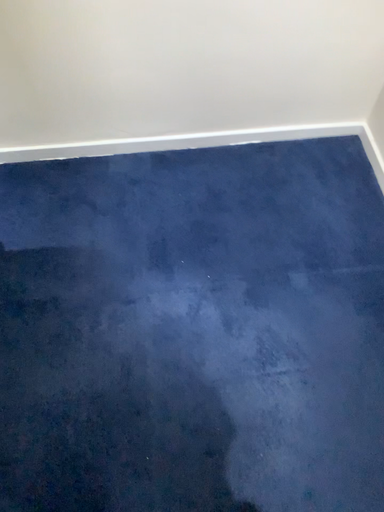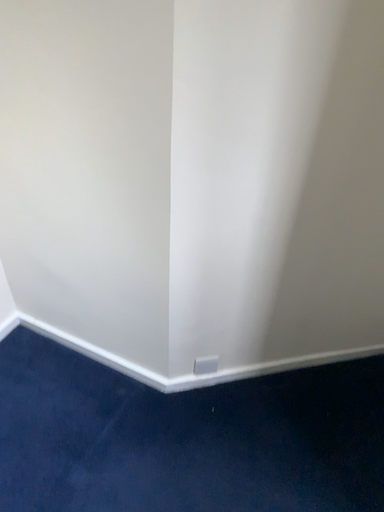
Question: Which way did the camera rotate in the video?

Choices:
 (A) rotated downward
 (B) rotated upward

Answer: (B)